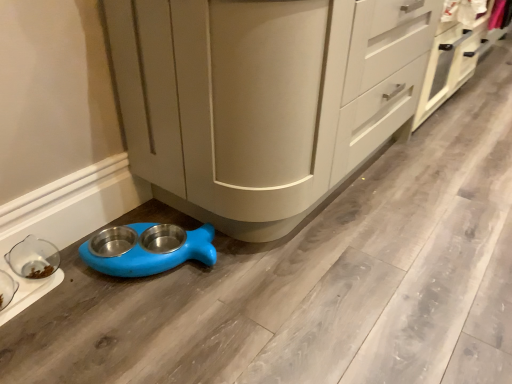
Question: Does point click(x=459, y=26) appear closer or farther from the camera than point click(x=98, y=261)?

Choices:
 (A) closer
 (B) farther

Answer: (B)

Question: From a real-world perspective, relative to blue plastic pet feeder at lower left, which is the 2th appliance from left to right, is white matte cabinet at center, which is counted as the second cabinetry, starting from the left, vertically above or below?

Choices:
 (A) above
 (B) below

Answer: (A)

Question: Estimate the real-world distances between objects in this image. Which object is farther from the transparent glass bowl at lower left, placed as the second appliance when sorted from right to left?

Choices:
 (A) matte beige cabinet at lower center, marked as the second cabinetry in a right-to-left arrangement
 (B) blue plastic pet feeder at lower left, the 1th appliance positioned from the right
 (C) white matte cabinet at center, the 1th cabinetry when ordered from right to left

Answer: (C)

Question: Which object is positioned closest to the matte beige cabinet at lower center, marked as the second cabinetry in a right-to-left arrangement?

Choices:
 (A) transparent glass bowl at lower left, placed as the second appliance when sorted from right to left
 (B) white matte cabinet at center, which is counted as the second cabinetry, starting from the left
 (C) blue plastic pet feeder at lower left, which is the 2th appliance from left to right

Answer: (C)